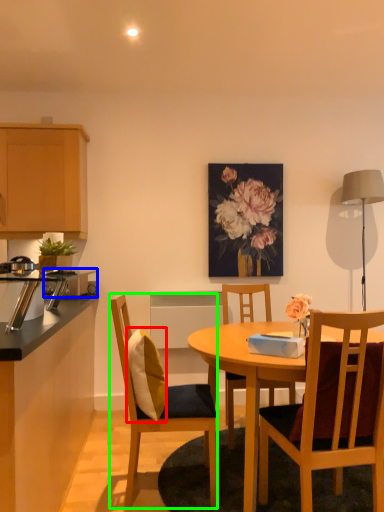
Question: Which object is the farthest from pillow (highlighted by a red box)? Choose among these: appliance (highlighted by a blue box) or chair (highlighted by a green box).

Choices:
 (A) appliance
 (B) chair

Answer: (A)